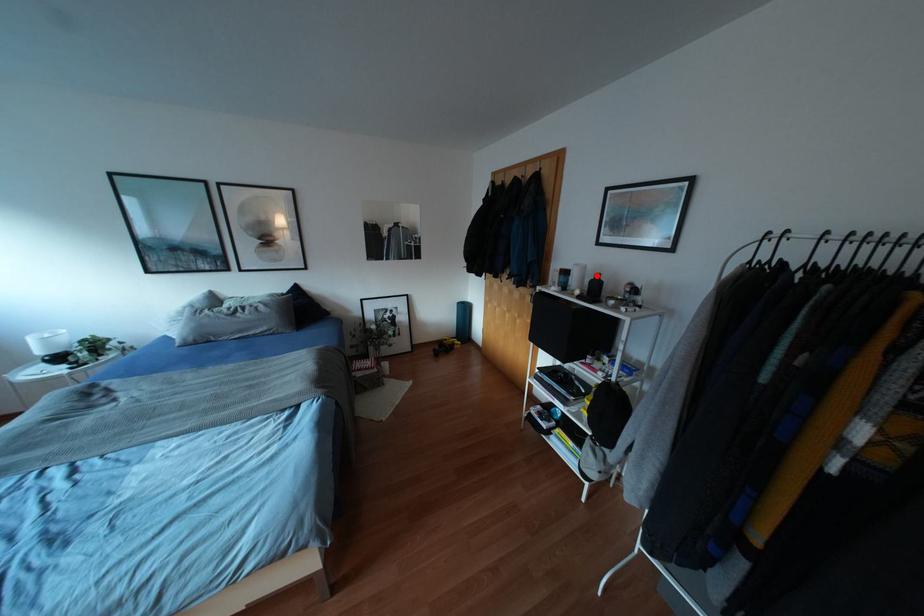
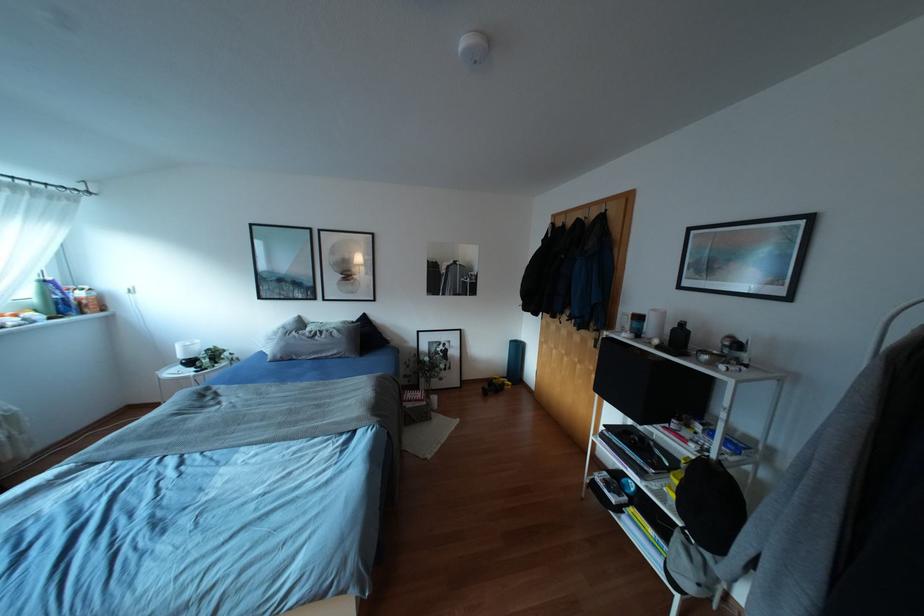
The point at the highlighted location is marked in the first image. Where is the corresponding point in the second image?

(682, 323)